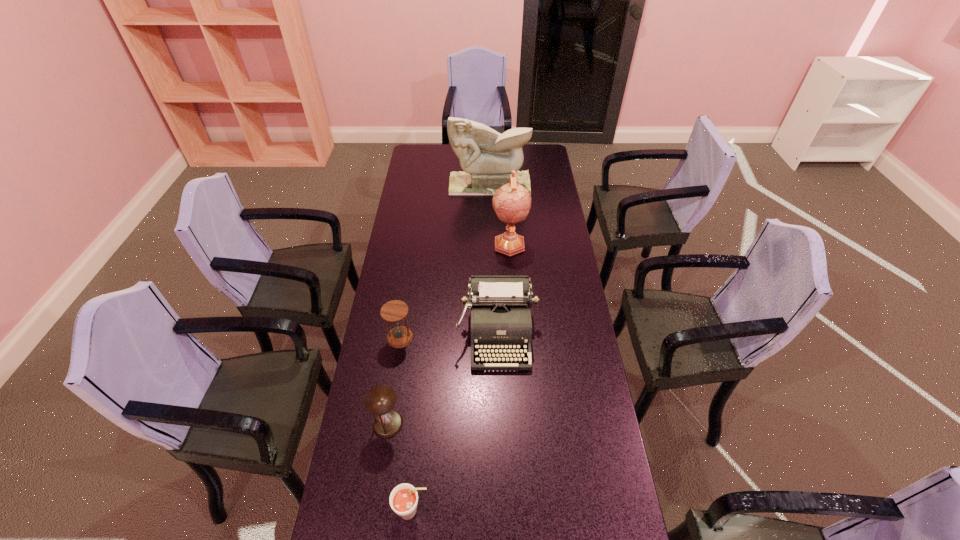
Locate an element on the screen. vacant area that lies between the farther hourglass and the globe is located at coordinates (455, 291).

Locate an element on the screen. free space between the farthest object and the typewriter is located at coordinates (493, 259).

Find the location of `free spot between the second nearest object and the farther hourglass`. free spot between the second nearest object and the farther hourglass is located at coordinates (394, 381).

Locate which object ranks fourth in proximity to the farther hourglass. Please provide its 2D coordinates. Your answer should be formatted as a tuple, i.e. [(x, y)], where the tuple contains the x and y coordinates of a point satisfying the conditions above.

[(403, 499)]

Where is `object that is the fifth closest to the farthest object`? The width and height of the screenshot is (960, 540). object that is the fifth closest to the farthest object is located at coordinates (403, 499).

Locate an element on the screen. vacant position in the image that satisfies the following two spatial constraints: 1. on the front-facing side of the typewriter; 2. on the drink side of the root beer is located at coordinates (503, 511).